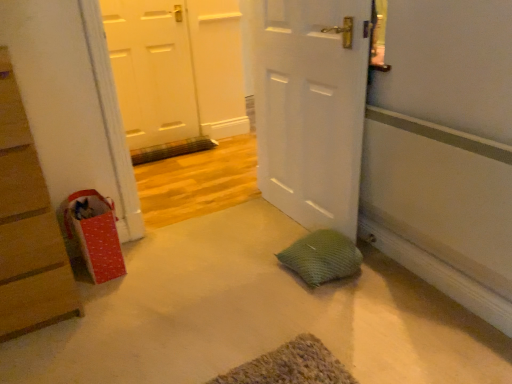
This screenshot has height=384, width=512. Identify the location of vacant area situated below white matte door at center, which appears as the 2th door when viewed from the left (from a real-world perspective). (284, 217).